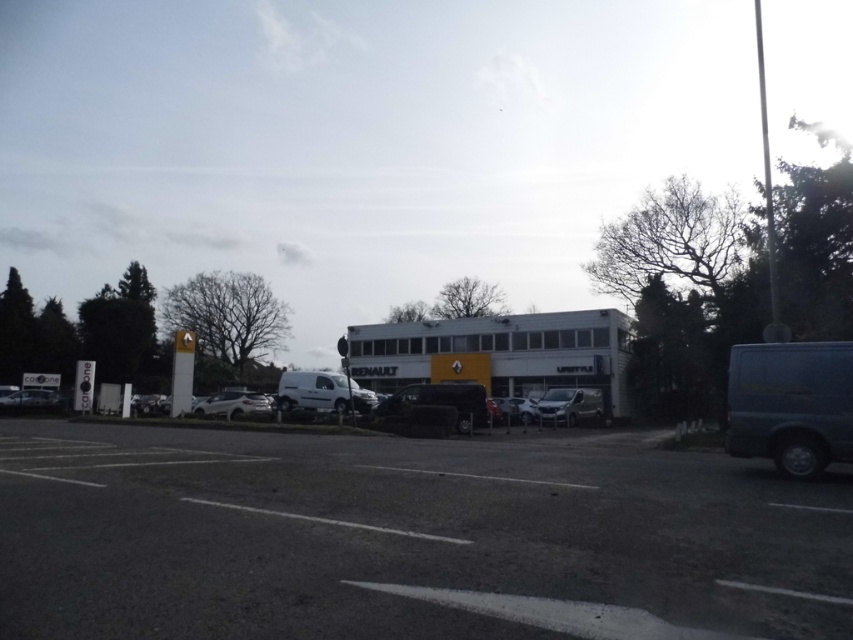
Is point (334, 372) positioned after point (242, 416)?

Yes, point (334, 372) is behind point (242, 416).

Between white matte van at center and white glossy car at center, which one appears on the right side from the viewer's perspective?

From the viewer's perspective, white matte van at center appears more on the right side.

Between point (300, 378) and point (264, 401), which one is positioned behind?

The point (300, 378) is more distant.

You are a GUI agent. You are given a task and a screenshot of the screen. Output one action in this format:
    pyautogui.click(x=<x>, y=<y>)
    Task: Click on the white matte van at center
    The width and height of the screenshot is (853, 640).
    Given the screenshot: What is the action you would take?
    pyautogui.click(x=322, y=392)

Who is shorter, satin silver van at center or shiny silver car at lower left?

Standing shorter between the two is shiny silver car at lower left.

Find the location of a particular element. This screenshot has height=640, width=853. satin silver van at center is located at coordinates (570, 404).

Based on the photo, which is more to the left, dark blue metallic van at right or satin silver van at center?

Positioned to the left is dark blue metallic van at right.

What do you see at coordinates (790, 404) in the screenshot? I see `dark blue metallic van at right` at bounding box center [790, 404].

Image resolution: width=853 pixels, height=640 pixels. I want to click on dark blue metallic van at right, so click(790, 404).